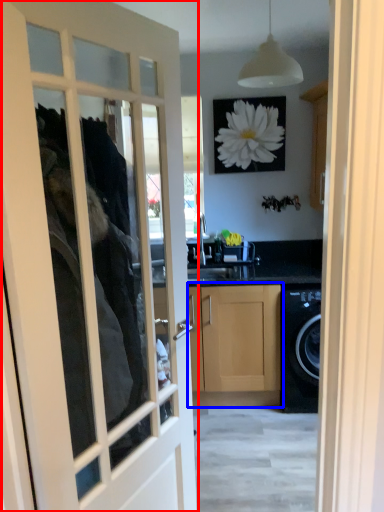
Question: Which object appears farthest to the camera in this image, door (highlighted by a red box) or cabinetry (highlighted by a blue box)?

Choices:
 (A) door
 (B) cabinetry

Answer: (B)